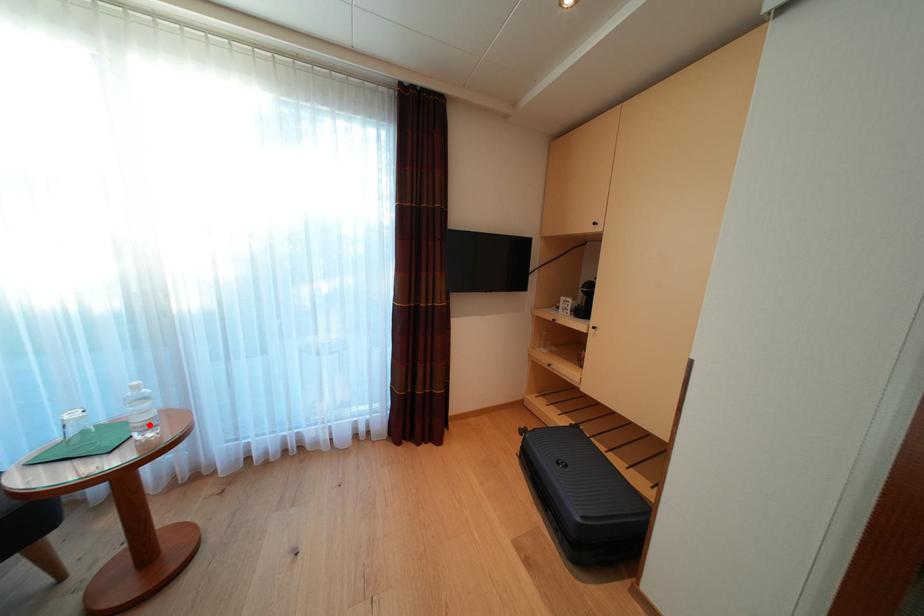
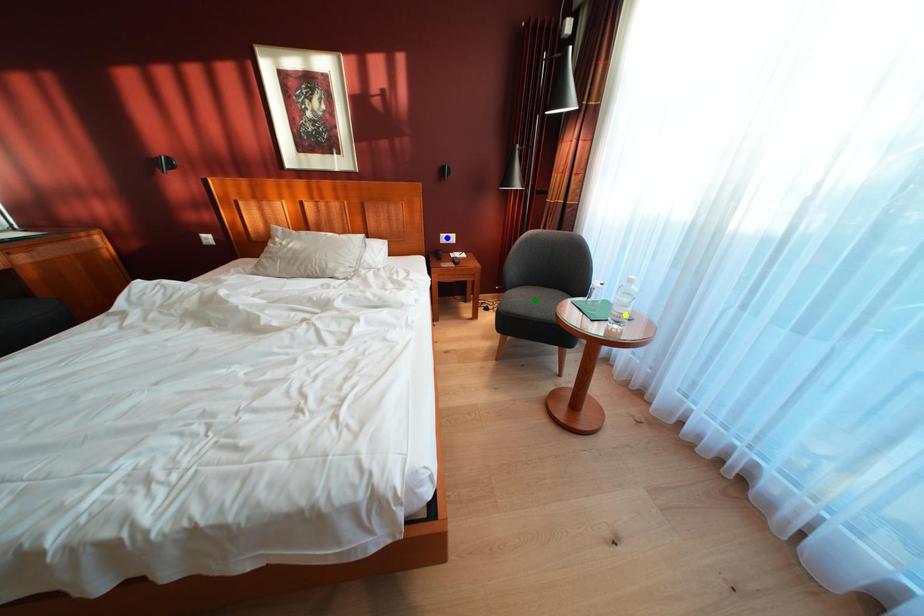
Question: I am providing you with two images of the same scene from different viewpoints. A red point is marked on the first image. You are given multiple points on the second image. Which spot in image 2 lines up with the point in image 1?

Choices:
 (A) yellow point
 (B) green point
 (C) blue point

Answer: (A)